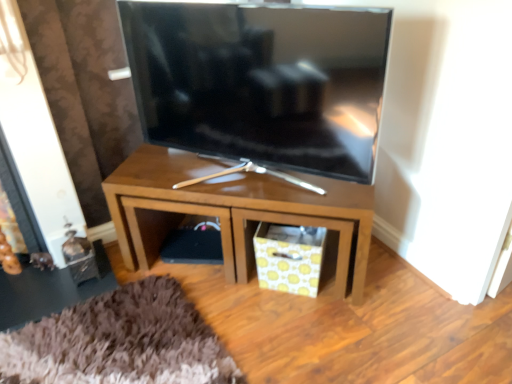
Locate an element on the screen. The width and height of the screenshot is (512, 384). vacant space to the left of yellow patterned paper at lower center is located at coordinates click(x=233, y=298).